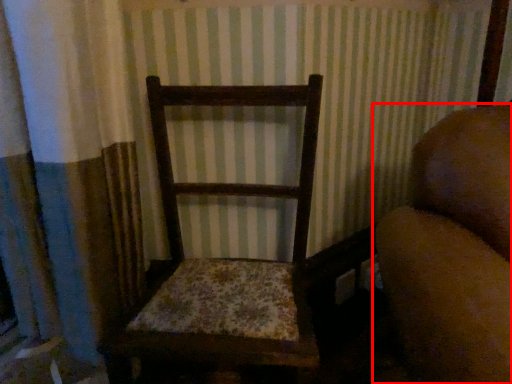
Question: From the image's perspective, what is the correct spatial positioning of furniture (annotated by the red box) in reference to rocking chair?

Choices:
 (A) below
 (B) above

Answer: (A)